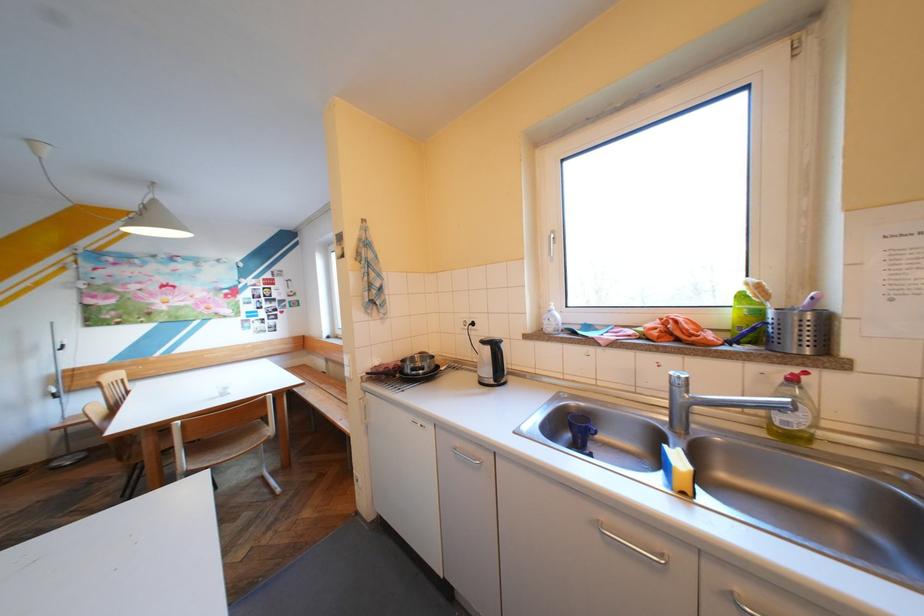
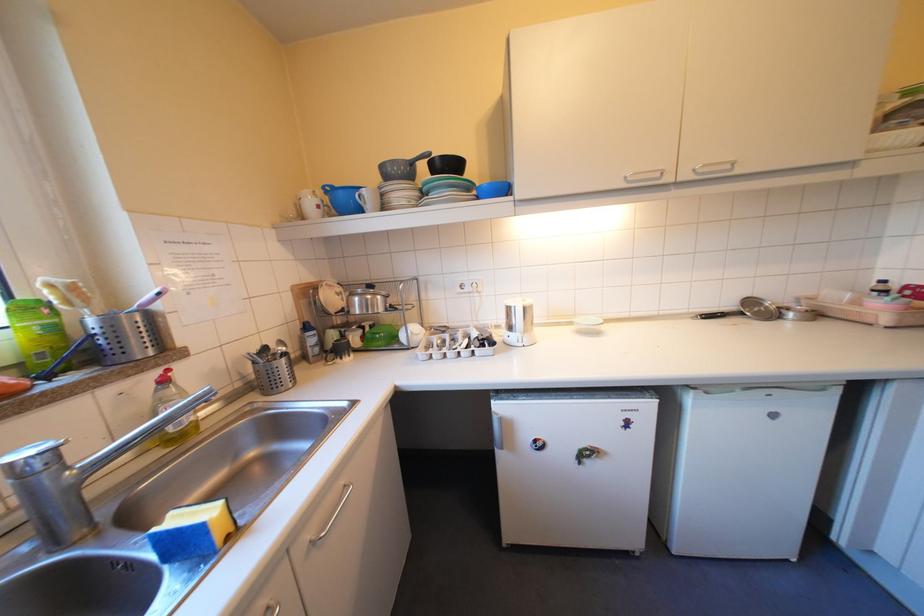
In the second image, find the point that corresponds to point (809, 370) in the first image.

(168, 371)